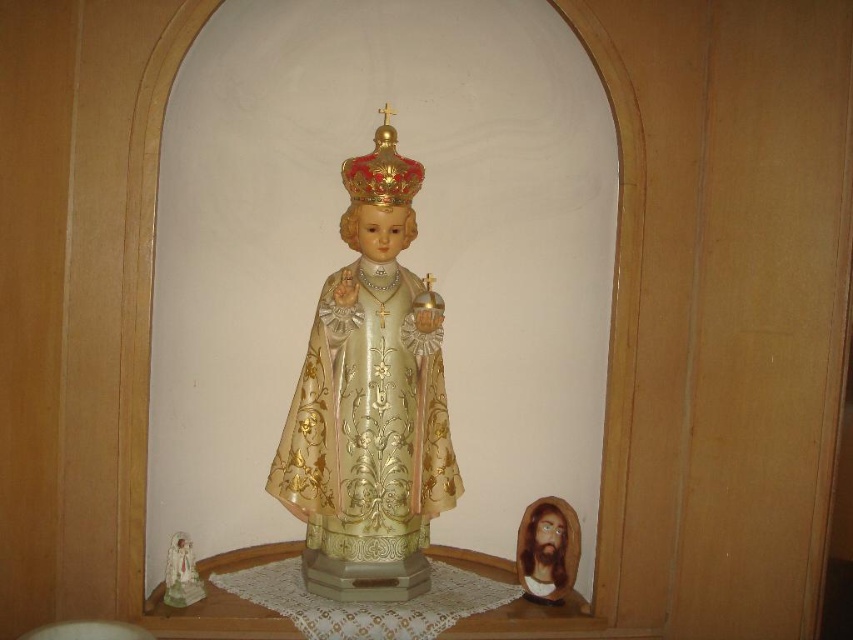
Is gold/polished metal crown at center shorter than porcelain statue at center?

Incorrect, gold/polished metal crown at center's height does not fall short of porcelain statue at center's.

Is gold/polished metal crown at center to the left of porcelain statue at center from the viewer's perspective?

No, gold/polished metal crown at center is not to the left of porcelain statue at center.

Which is behind, point (419, 176) or point (178, 586)?

Point (419, 176)

Image resolution: width=853 pixels, height=640 pixels. In order to click on gold/polished metal crown at center in this screenshot , I will do `click(381, 170)`.

How much distance is there between gold glossy statue at center and porcelain statue at center?

gold glossy statue at center is 16.43 inches away from porcelain statue at center.

Does gold glossy statue at center come in front of porcelain statue at center?

Yes.

Where is `gold glossy statue at center`? This screenshot has width=853, height=640. gold glossy statue at center is located at coordinates (370, 401).

Does brown wooden head at lower right have a lesser width compared to gold/polished metal crown at center?

Indeed, brown wooden head at lower right has a lesser width compared to gold/polished metal crown at center.

Does point (549, 588) come farther from viewer compared to point (393, 132)?

Yes, it is.

Which is in front, point (549, 593) or point (372, 177)?

Point (372, 177) is in front.

Find the location of a particular element. The height and width of the screenshot is (640, 853). brown wooden head at lower right is located at coordinates (547, 548).